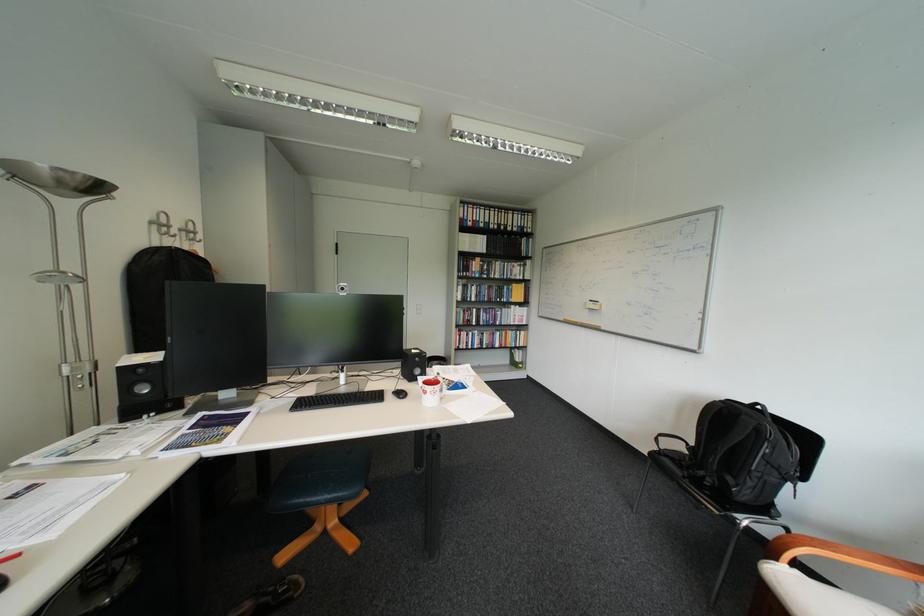
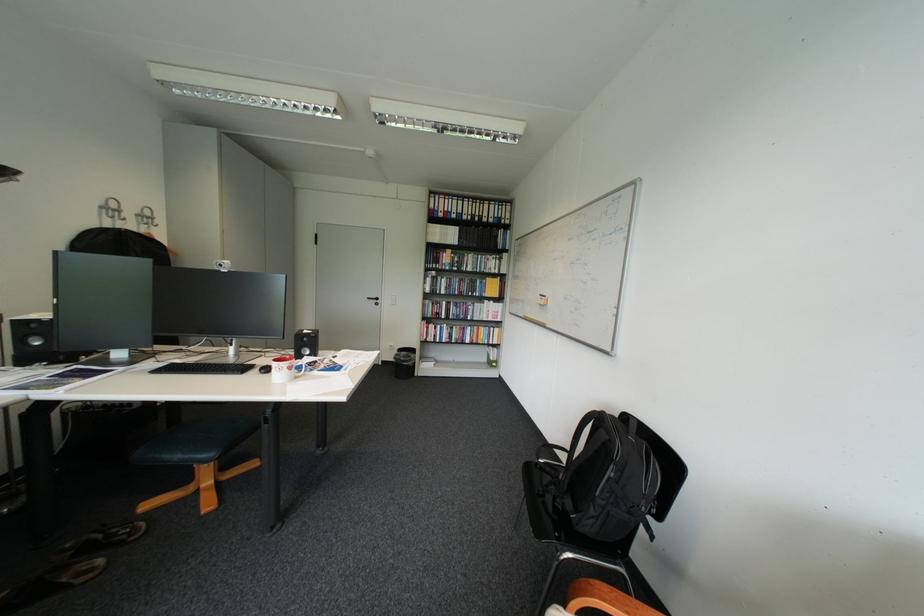
Where in the second image is the point corresponding to point (429, 360) from the first image?

(317, 339)